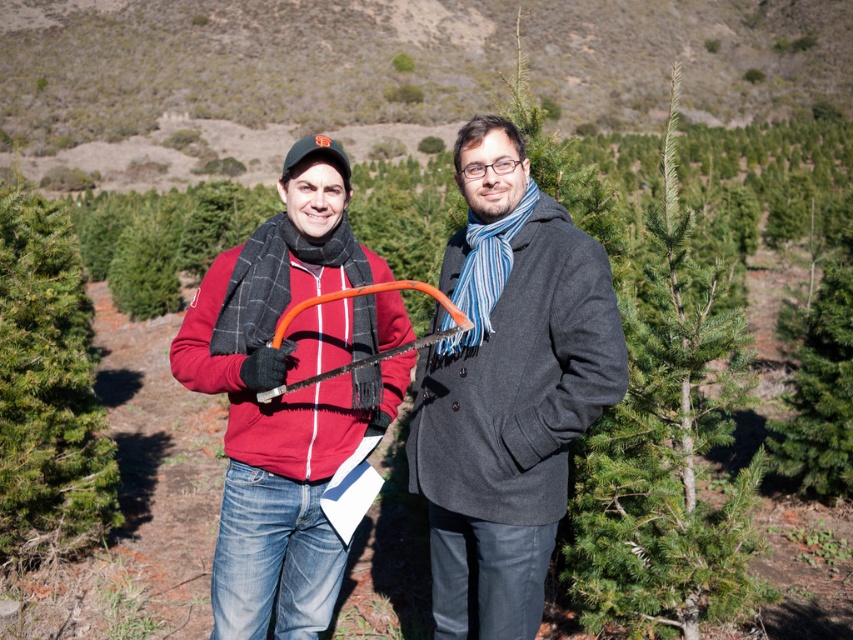
You are a photographer trying to capture both the matte red sweater at center and the charcoal wool coat at center in a single frame. Since you want both subjects to be clearly visible, which direction should you position your camera relative to the subjects to ensure both are fully in the shot?

Position your camera to the right side of the subjects so that the matte red sweater at center on the left and the charcoal wool coat at center are both fully visible in the frame.